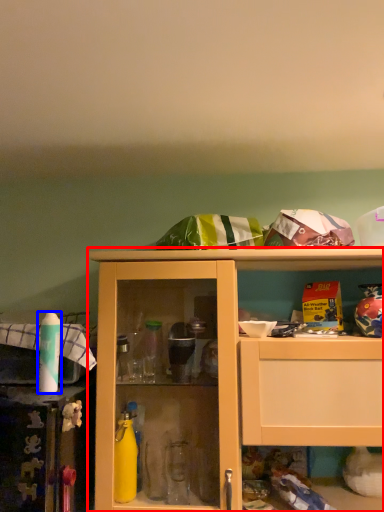
Question: Which object is further to the camera taking this photo, cabinetry (highlighted by a red box) or bottle (highlighted by a blue box)?

Choices:
 (A) cabinetry
 (B) bottle

Answer: (B)